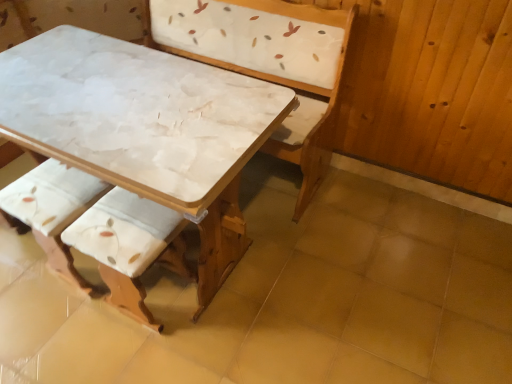
Where is `white marble table at center`? The width and height of the screenshot is (512, 384). white marble table at center is located at coordinates (288, 298).

Where is `white fabric cushion at lower left, which is the 2th armchair from right to left`? This screenshot has height=384, width=512. white fabric cushion at lower left, which is the 2th armchair from right to left is located at coordinates (52, 209).

You are a GUI agent. You are given a task and a screenshot of the screen. Output one action in this format:
    pyautogui.click(x=<x>, y=<y>)
    Task: Click on the white fabric cushion at lower left, the 2th armchair positioned from the left
    
    Given the screenshot: What is the action you would take?
    pyautogui.click(x=130, y=246)

Identify the location of white marble table at center. (142, 149).

Which of these two, white marble table at center or white fabric cushion at lower left, the 1th armchair from the right, is wider?

Wider between the two is white marble table at center.

Is white marble table at center positioned far away from white fabric cushion at lower left, the 1th armchair from the right?

white marble table at center is near white fabric cushion at lower left, the 1th armchair from the right, not far away.

Looking at this image, is white marble table at center further to the viewer compared to white fabric cushion at lower left, the 1th armchair from the right?

That is False.

Which point is more forward, (140, 198) or (48, 244)?

Positioned in front is point (140, 198).

Is white fabric cushion at lower left, the 1th armchair from the right, situated inside white fabric cushion at lower left, arranged as the 1th armchair when viewed from the left, or outside?

white fabric cushion at lower left, the 1th armchair from the right, lies outside white fabric cushion at lower left, arranged as the 1th armchair when viewed from the left.

Between white fabric cushion at lower left, the 1th armchair from the right, and white fabric cushion at lower left, which is the 2th armchair from right to left, which one is positioned behind?

white fabric cushion at lower left, which is the 2th armchair from right to left, is further away from the camera.

In the scene shown: From their relative heights in the image, would you say white fabric cushion at lower left, the 1th armchair from the right, is taller or shorter than white fabric cushion at lower left, which is the 2th armchair from right to left?

white fabric cushion at lower left, the 1th armchair from the right, is taller than white fabric cushion at lower left, which is the 2th armchair from right to left.

Is white fabric cushion at lower left, the 2th armchair positioned from the left, far from white marble table at center?

No.

Which object is thinner, white fabric cushion at lower left, the 1th armchair from the right, or white marble table at center?

With smaller width is white fabric cushion at lower left, the 1th armchair from the right.

In the scene shown: Considering the relative positions of white fabric cushion at lower left, the 1th armchair from the right, and white marble table at center in the image provided, is white fabric cushion at lower left, the 1th armchair from the right, to the left of white marble table at center from the viewer's perspective?

No, white fabric cushion at lower left, the 1th armchair from the right, is not to the left of white marble table at center.

This screenshot has width=512, height=384. I want to click on tile below the white fabric cushion at lower left, arranged as the 1th armchair when viewed from the left (from a real-world perspective), so click(x=288, y=298).

From a real-world perspective, is white fabric cushion at lower left, which is the 2th armchair from right to left, physically below white marble table at center?

No, from a real-world perspective, white fabric cushion at lower left, which is the 2th armchair from right to left, is not under white marble table at center.

Who is taller, white fabric cushion at lower left, arranged as the 1th armchair when viewed from the left, or white marble table at center?

white fabric cushion at lower left, arranged as the 1th armchair when viewed from the left, is taller.

From the image's perspective, does white fabric cushion at lower left, which is the 2th armchair from right to left, appear lower than white marble table at center?

Incorrect, from the image's perspective, white fabric cushion at lower left, which is the 2th armchair from right to left, is higher than white marble table at center.

From a real-world perspective, is white fabric cushion at lower left, the 1th armchair from the right, positioned under white marble table at center based on gravity?

No, from a real-world perspective, white fabric cushion at lower left, the 1th armchair from the right, is not below white marble table at center.

Would you say white marble table at center is part of white fabric cushion at lower left, the 2th armchair positioned from the left,'s contents?

No, white marble table at center is located outside of white fabric cushion at lower left, the 2th armchair positioned from the left.

In the scene shown: Is the position of white fabric cushion at lower left, the 1th armchair from the right, less distant than that of white marble table at center?

No, it is behind white marble table at center.

In terms of height, does white marble table at center look taller or shorter compared to white fabric cushion at lower left, the 2th armchair positioned from the left?

white marble table at center is taller than white fabric cushion at lower left, the 2th armchair positioned from the left.

From the image's perspective, which one is positioned lower, white marble table at center or white fabric cushion at lower left, the 1th armchair from the right?

white fabric cushion at lower left, the 1th armchair from the right, appears lower in the image.

From a real-world perspective, is white marble table at center above or below white fabric cushion at lower left, the 1th armchair from the right?

From a real-world perspective, white marble table at center is physically above white fabric cushion at lower left, the 1th armchair from the right.

Between white fabric cushion at lower left, arranged as the 1th armchair when viewed from the left, and white fabric cushion at lower left, the 2th armchair positioned from the left, which one is positioned in front?

white fabric cushion at lower left, the 2th armchair positioned from the left, is closer to the camera.

Consider the image. From a real-world perspective, who is located lower, white fabric cushion at lower left, which is the 2th armchair from right to left, or white fabric cushion at lower left, the 1th armchair from the right?

In real-world perspective, white fabric cushion at lower left, which is the 2th armchair from right to left, is lower.

Considering the sizes of white fabric cushion at lower left, arranged as the 1th armchair when viewed from the left, and white fabric cushion at lower left, the 1th armchair from the right, in the image, is white fabric cushion at lower left, arranged as the 1th armchair when viewed from the left, taller or shorter than white fabric cushion at lower left, the 1th armchair from the right,?

Clearly, white fabric cushion at lower left, arranged as the 1th armchair when viewed from the left, is shorter compared to white fabric cushion at lower left, the 1th armchair from the right.

Would you consider white fabric cushion at lower left, which is the 2th armchair from right to left, to be distant from white fabric cushion at lower left, the 1th armchair from the right?

That's not correct — white fabric cushion at lower left, which is the 2th armchair from right to left, is a little close to white fabric cushion at lower left, the 1th armchair from the right.

At what (x,y) coordinates should I click in order to perform the action: click on armchair that is the 2nd one above the white marble table at center (from a real-world perspective). Please return your answer as a coordinate pair (x, y). The height and width of the screenshot is (384, 512). Looking at the image, I should click on (130, 246).

You are a GUI agent. You are given a task and a screenshot of the screen. Output one action in this format:
    pyautogui.click(x=<x>, y=<y>)
    Task: Click on the armchair above the white fabric cushion at lower left, the 2th armchair positioned from the left (from the image's perspective)
    The image size is (512, 384).
    Given the screenshot: What is the action you would take?
    pyautogui.click(x=52, y=209)

When comparing their distances from white marble table at center, does white fabric cushion at lower left, the 1th armchair from the right, or white fabric cushion at lower left, arranged as the 1th armchair when viewed from the left, seem closer?

white fabric cushion at lower left, the 1th armchair from the right, is positioned closer to the anchor white marble table at center.

From the image, which object appears to be farther from white fabric cushion at lower left, arranged as the 1th armchair when viewed from the left, white marble table at center or white marble table at center?

Based on the image, white marble table at center appears to be further to white fabric cushion at lower left, arranged as the 1th armchair when viewed from the left.

From the image, which object appears to be nearer to white fabric cushion at lower left, the 2th armchair positioned from the left, white marble table at center or white fabric cushion at lower left, arranged as the 1th armchair when viewed from the left?

Based on the image, white fabric cushion at lower left, arranged as the 1th armchair when viewed from the left, appears to be nearer to white fabric cushion at lower left, the 2th armchair positioned from the left.

Considering their positions, is white fabric cushion at lower left, arranged as the 1th armchair when viewed from the left, positioned further to white fabric cushion at lower left, the 2th armchair positioned from the left, than white marble table at center?

white marble table at center.

From the image, which object appears to be nearer to white marble table at center, white marble table at center or white fabric cushion at lower left, arranged as the 1th armchair when viewed from the left?

white fabric cushion at lower left, arranged as the 1th armchair when viewed from the left, is positioned closer to the anchor white marble table at center.

From the image, which object appears to be nearer to white fabric cushion at lower left, arranged as the 1th armchair when viewed from the left, white fabric cushion at lower left, the 2th armchair positioned from the left, or white marble table at center?

Based on the image, white fabric cushion at lower left, the 2th armchair positioned from the left, appears to be nearer to white fabric cushion at lower left, arranged as the 1th armchair when viewed from the left.

Based on their spatial positions, is white fabric cushion at lower left, the 2th armchair positioned from the left, or white marble table at center further from white marble table at center?

white marble table at center is positioned further to the anchor white marble table at center.

Looking at the image, which one is located further to white marble table at center, white fabric cushion at lower left, the 1th armchair from the right, or white marble table at center?

white marble table at center is further to white marble table at center.

Find the location of a particular element. armchair located between white marble table at center and white marble table at center in the left-right direction is located at coordinates (130, 246).

The image size is (512, 384). I want to click on table between white fabric cushion at lower left, which is the 2th armchair from right to left, and white marble table at center, so click(142, 149).

You are a GUI agent. You are given a task and a screenshot of the screen. Output one action in this format:
    pyautogui.click(x=<x>, y=<y>)
    Task: Click on the armchair positioned between white marble table at center and white fabric cushion at lower left, arranged as the 1th armchair when viewed from the left, from near to far
    
    Given the screenshot: What is the action you would take?
    pyautogui.click(x=130, y=246)

This screenshot has width=512, height=384. I want to click on armchair between white fabric cushion at lower left, arranged as the 1th armchair when viewed from the left, and white marble table at center, in the horizontal direction, so click(130, 246).